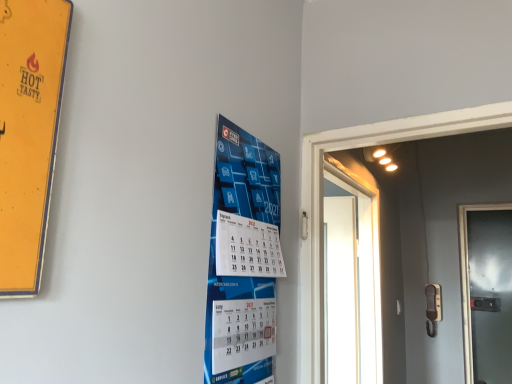
Question: Can you confirm if white glossy door at right, which is the second door from right to left, is shorter than metallic glass door at right, the first door positioned from the back?

Choices:
 (A) no
 (B) yes

Answer: (B)

Question: Is white glossy door at right, which is the second door from right to left, closer to camera compared to metallic glass door at right, the first door positioned from the back?

Choices:
 (A) yes
 (B) no

Answer: (A)

Question: Can you confirm if white glossy door at right, which is the first door in left-to-right order, is taller than metallic glass door at right, the 2th door viewed from the front?

Choices:
 (A) yes
 (B) no

Answer: (B)

Question: Is white glossy door at right, which is the second door from right to left, next to metallic glass door at right, the first door positioned from the back, and touching it?

Choices:
 (A) yes
 (B) no

Answer: (B)

Question: Can you confirm if white glossy door at right, arranged as the 2th door when viewed from the back, is thinner than metallic glass door at right, the 2th door viewed from the front?

Choices:
 (A) no
 (B) yes

Answer: (A)

Question: In the image, is metallic glass door at right, the 1th door from the right, on the left side or the right side of white glossy door at right, the 1th door positioned from the front?

Choices:
 (A) right
 (B) left

Answer: (A)

Question: Considering their positions, is metallic glass door at right, the 2th door viewed from the front, located in front of or behind white glossy door at right, the 1th door positioned from the front?

Choices:
 (A) front
 (B) behind

Answer: (B)

Question: From the image's perspective, relative to white glossy door at right, which is the second door from right to left, is metallic glass door at right, the 1th door from the right, above or below?

Choices:
 (A) below
 (B) above

Answer: (A)

Question: Is point (507, 294) closer or farther from the camera than point (366, 210)?

Choices:
 (A) farther
 (B) closer

Answer: (A)

Question: Is blue paper calendar at center wider or thinner than beige matte door handle at right?

Choices:
 (A) thin
 (B) wide

Answer: (A)

Question: From a real-world perspective, is blue paper calendar at center physically located above or below beige matte door handle at right?

Choices:
 (A) above
 (B) below

Answer: (A)

Question: Considering their positions, is blue paper calendar at center located in front of or behind beige matte door handle at right?

Choices:
 (A) front
 (B) behind

Answer: (A)

Question: From the image's perspective, is blue paper calendar at center located above or below beige matte door handle at right?

Choices:
 (A) below
 (B) above

Answer: (B)

Question: From a real-world perspective, is beige matte door handle at right above or below white glossy door at right, which is the first door in left-to-right order?

Choices:
 (A) above
 (B) below

Answer: (B)

Question: In the image, is beige matte door handle at right on the left side or the right side of white glossy door at right, arranged as the 2th door when viewed from the back?

Choices:
 (A) right
 (B) left

Answer: (A)